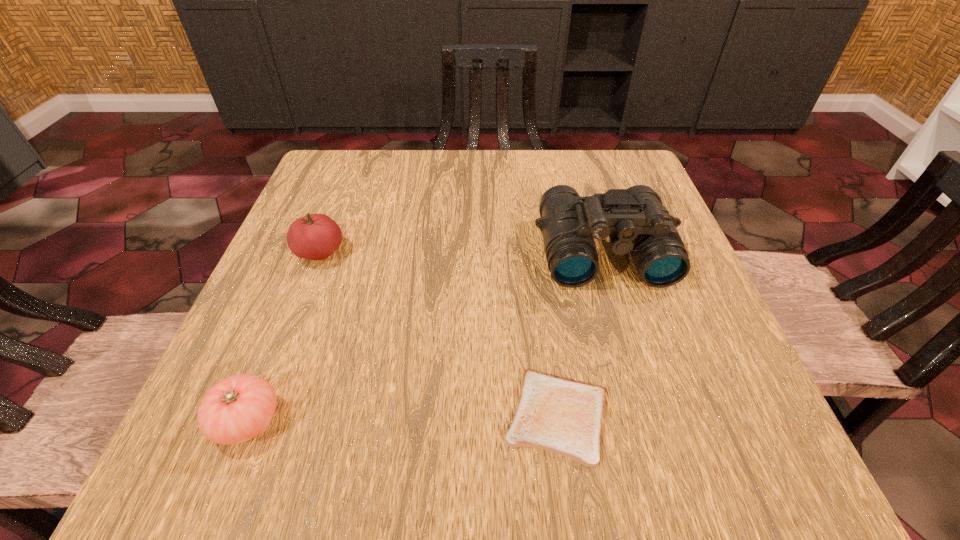
You are a GUI agent. You are given a task and a screenshot of the screen. Output one action in this format:
    pyautogui.click(x=<x>, y=<y>)
    Task: Click on the tomato at the near edge
    The image size is (960, 540).
    Given the screenshot: What is the action you would take?
    pyautogui.click(x=238, y=408)

Image resolution: width=960 pixels, height=540 pixels. I want to click on toast that is at the near edge, so click(563, 416).

At what (x,y) coordinates should I click in order to perform the action: click on object present at the right edge. Please return your answer as a coordinate pair (x, y). This screenshot has height=540, width=960. Looking at the image, I should click on (635, 220).

The image size is (960, 540). What are the coordinates of `object present at the near left corner` in the screenshot? It's located at (238, 408).

Find the location of a particular element. free space at the far edge of the desktop is located at coordinates (511, 173).

Image resolution: width=960 pixels, height=540 pixels. In the image, there is a desktop. In order to click on free space at the left edge in this screenshot , I will do `click(293, 371)`.

The width and height of the screenshot is (960, 540). I want to click on vacant space at the right edge, so pos(664,318).

In the image, there is a desktop. Where is `free space at the far left corner`? Image resolution: width=960 pixels, height=540 pixels. free space at the far left corner is located at coordinates tap(324, 157).

Find the location of `blank space at the far right corner`. blank space at the far right corner is located at coordinates (644, 181).

In the image, there is a desktop. Where is `vacant space at the near right corner`? The image size is (960, 540). vacant space at the near right corner is located at coordinates (771, 468).